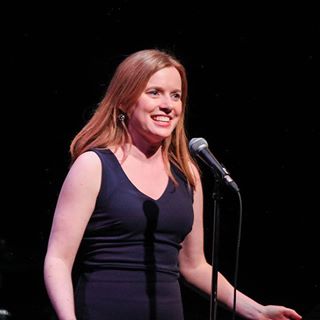
You are a GUI agent. You are given a task and a screenshot of the screen. Output one action in this format:
    pyautogui.click(x=<x>, y=<y>)
    Task: Click on the adjustable holding arm
    The width and height of the screenshot is (320, 320).
    Given the screenshot: What is the action you would take?
    217,179